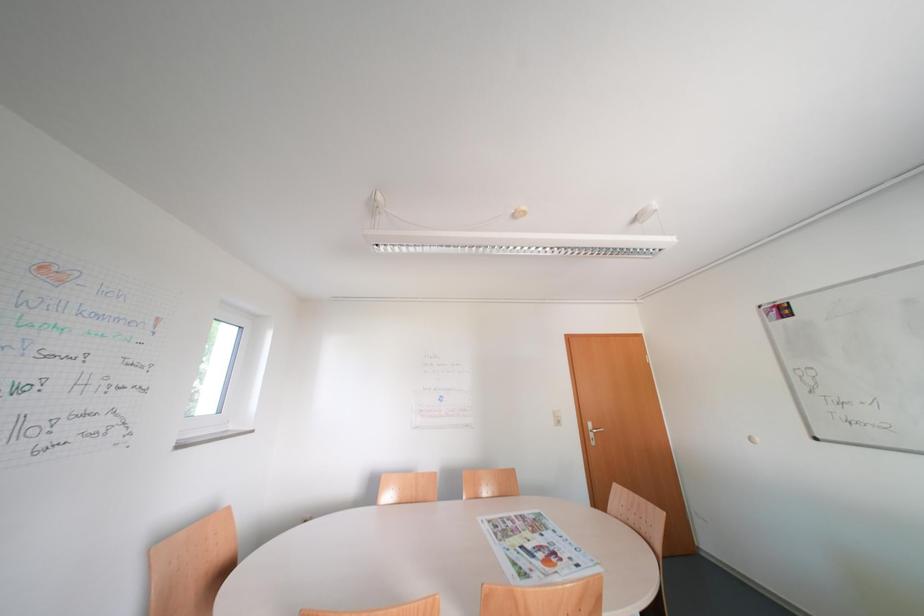
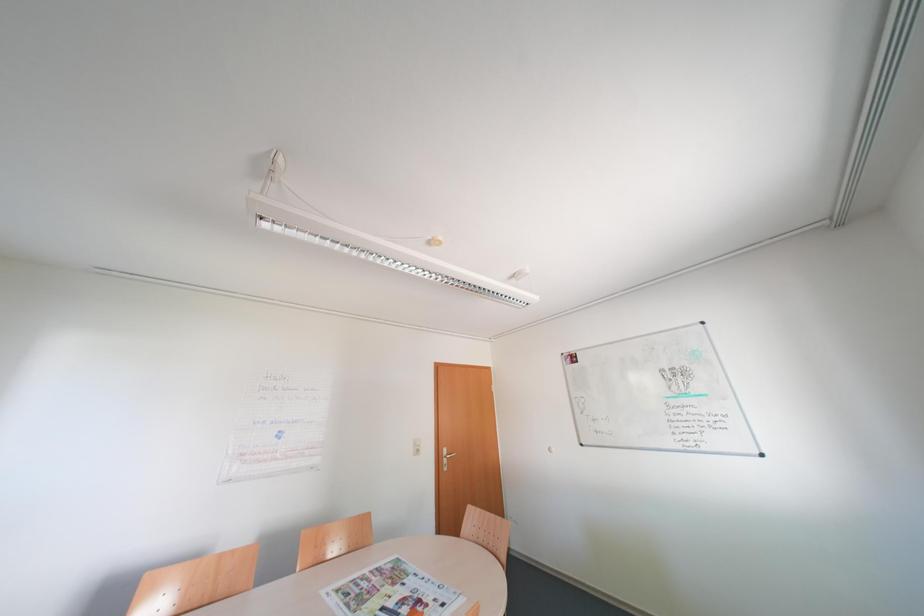
Question: Based on the continuous images, in which direction is the camera rotating? Reply with the corresponding letter.

Choices:
 (A) Left
 (B) Right
 (C) Up
 (D) Down

Answer: (B)